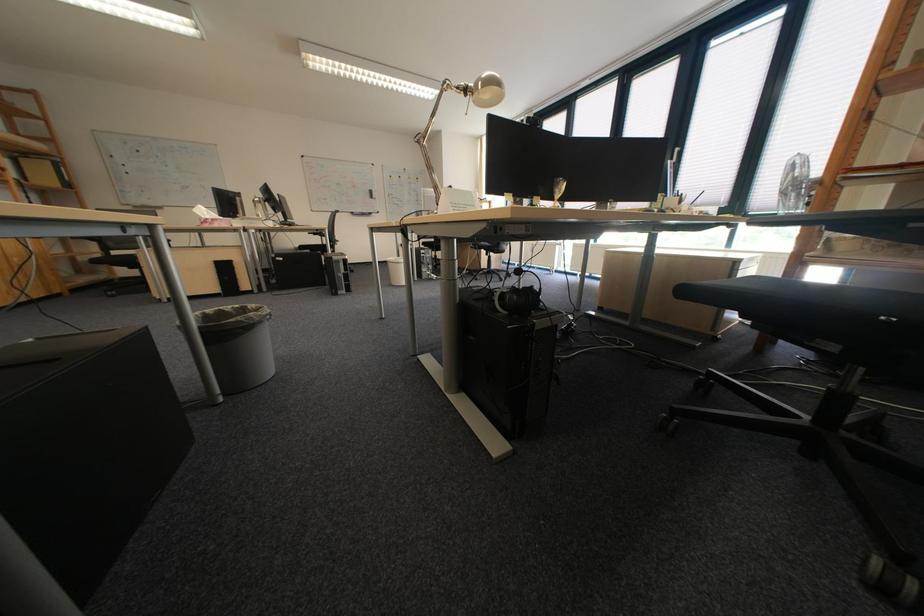
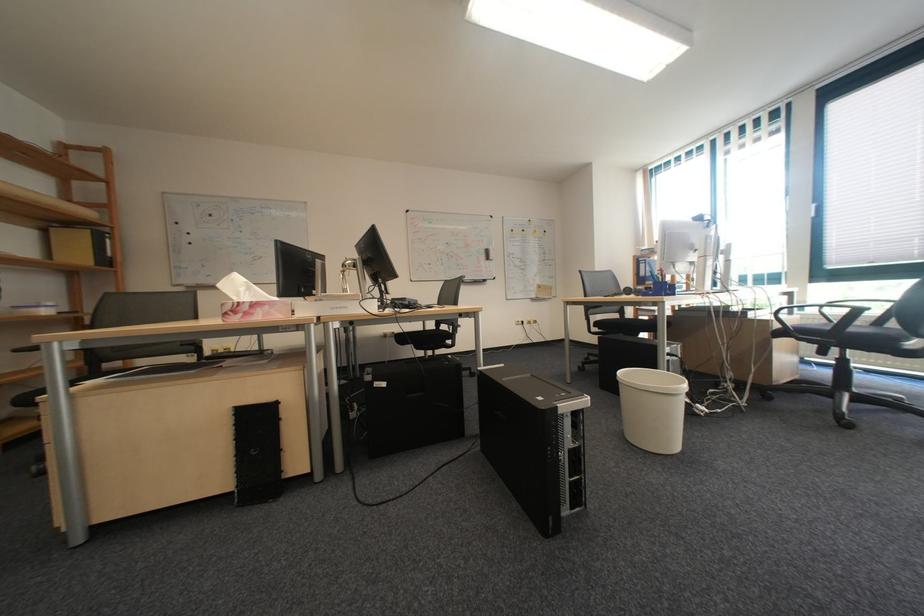
The point at (367,270) is marked in the first image. Where is the corresponding point in the second image?

(487, 371)